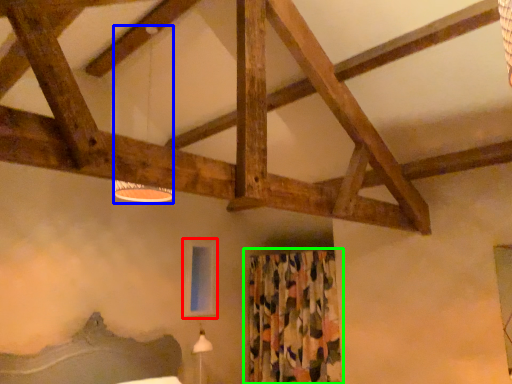
Question: Which object is the farthest from window screen (highlighted by a red box)? Choose among these: lamp (highlighted by a blue box) or curtain (highlighted by a green box).

Choices:
 (A) lamp
 (B) curtain

Answer: (A)